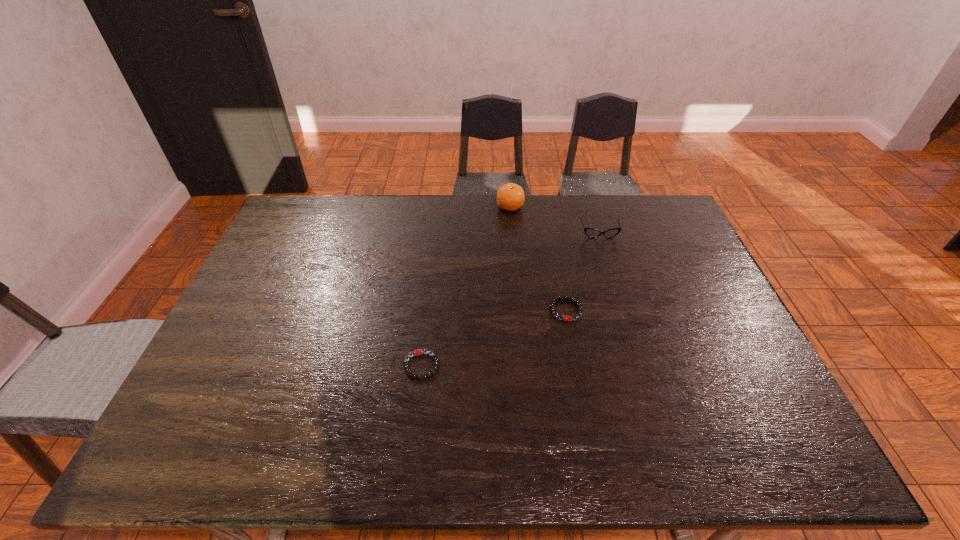
Identify the location of free spot located on the front of the farther bracelet. (585, 415).

You are a GUI agent. You are given a task and a screenshot of the screen. Output one action in this format:
    pyautogui.click(x=<x>, y=<y>)
    Task: Click on the free space located 0.380m on the left of the left bracelet
    The image size is (960, 540).
    Given the screenshot: What is the action you would take?
    pos(255,366)

Identify the location of clementine located at the far edge. (510, 197).

I want to click on spectacles located in the far edge section of the desktop, so click(590, 232).

In the image, there is a desktop. Where is `vacant space at the far edge`? The image size is (960, 540). vacant space at the far edge is located at coordinates (453, 221).

In the image, there is a desktop. Where is `vacant space at the near edge`? vacant space at the near edge is located at coordinates (317, 465).

I want to click on vacant region at the right edge of the desktop, so click(726, 329).

Locate an element on the screen. The height and width of the screenshot is (540, 960). vacant space at the far left corner of the desktop is located at coordinates (325, 218).

Find the location of a particular element. This screenshot has width=960, height=540. vacant space at the far right corner of the desktop is located at coordinates (629, 210).

This screenshot has height=540, width=960. Identify the location of free space at the near right corner of the desktop. (789, 462).